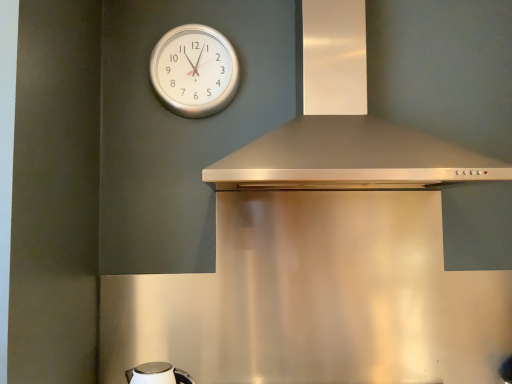
Question: From a real-world perspective, is satin silver vent at upper center over silver metallic clock at upper center?

Choices:
 (A) no
 (B) yes

Answer: (A)

Question: Considering the relative sizes of satin silver vent at upper center and silver metallic clock at upper center in the image provided, is satin silver vent at upper center wider than silver metallic clock at upper center?

Choices:
 (A) yes
 (B) no

Answer: (A)

Question: Can you confirm if satin silver vent at upper center is thinner than silver metallic clock at upper center?

Choices:
 (A) yes
 (B) no

Answer: (B)

Question: From a real-world perspective, is satin silver vent at upper center below silver metallic clock at upper center?

Choices:
 (A) no
 (B) yes

Answer: (B)

Question: Is satin silver vent at upper center to the left of silver metallic clock at upper center from the viewer's perspective?

Choices:
 (A) yes
 (B) no

Answer: (B)

Question: From the image's perspective, would you say satin silver vent at upper center is positioned over silver metallic clock at upper center?

Choices:
 (A) no
 (B) yes

Answer: (A)

Question: Is satin silver vent at upper center facing away from white glossy kettle at lower left?

Choices:
 (A) no
 (B) yes

Answer: (A)

Question: Is satin silver vent at upper center completely or partially outside of white glossy kettle at lower left?

Choices:
 (A) no
 (B) yes

Answer: (B)

Question: Is satin silver vent at upper center behind white glossy kettle at lower left?

Choices:
 (A) no
 (B) yes

Answer: (A)

Question: Is satin silver vent at upper center thinner than white glossy kettle at lower left?

Choices:
 (A) yes
 (B) no

Answer: (B)

Question: Could white glossy kettle at lower left be considered to be inside satin silver vent at upper center?

Choices:
 (A) no
 (B) yes

Answer: (A)

Question: From a real-world perspective, is satin silver vent at upper center positioned over white glossy kettle at lower left based on gravity?

Choices:
 (A) yes
 (B) no

Answer: (A)

Question: Can you confirm if silver metallic clock at upper center is positioned to the left of white glossy kettle at lower left?

Choices:
 (A) no
 (B) yes

Answer: (A)